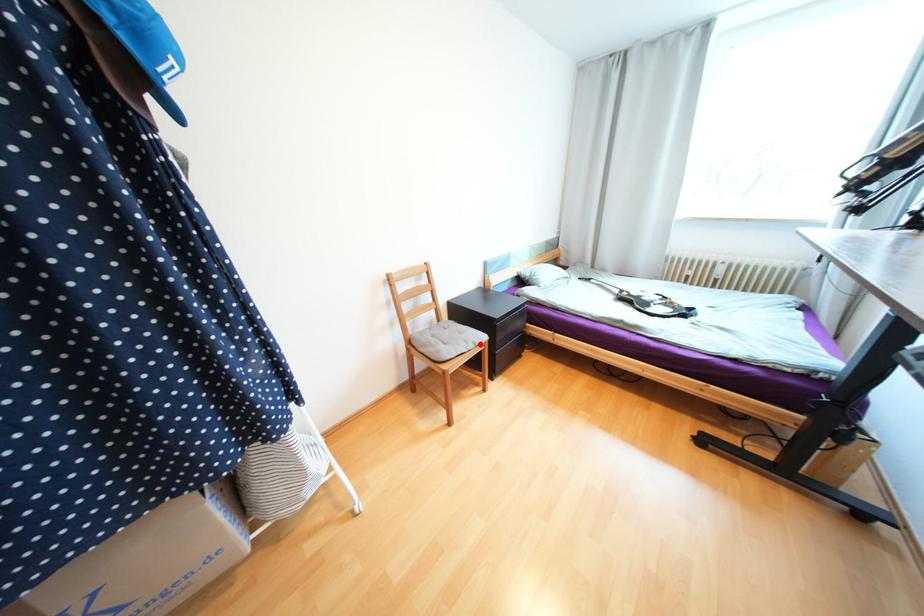
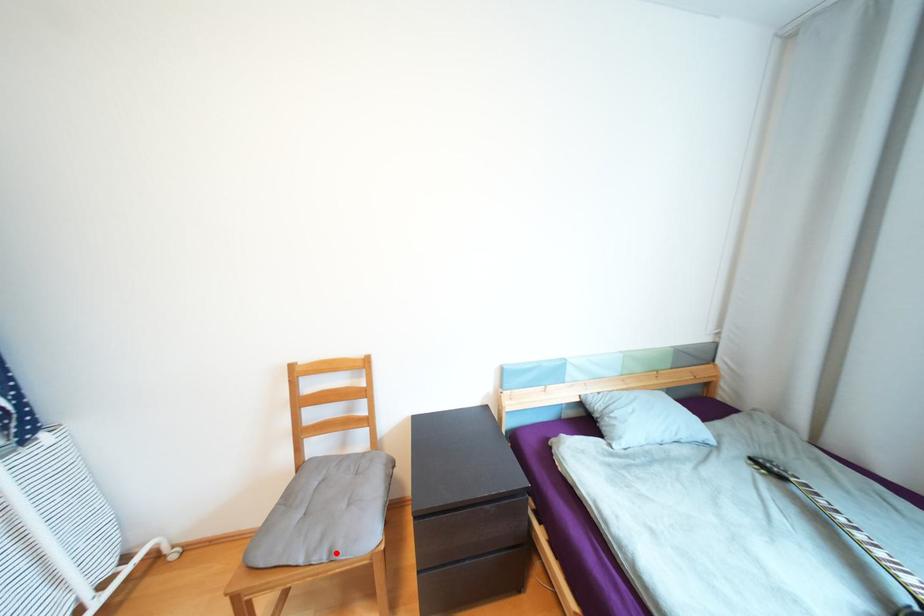
I am providing you with two images of the same scene from different viewpoints. A red point is marked on the first image and another point is marked on the second image. Is the red point in image1 aligned with the point shown in image2?

Yes